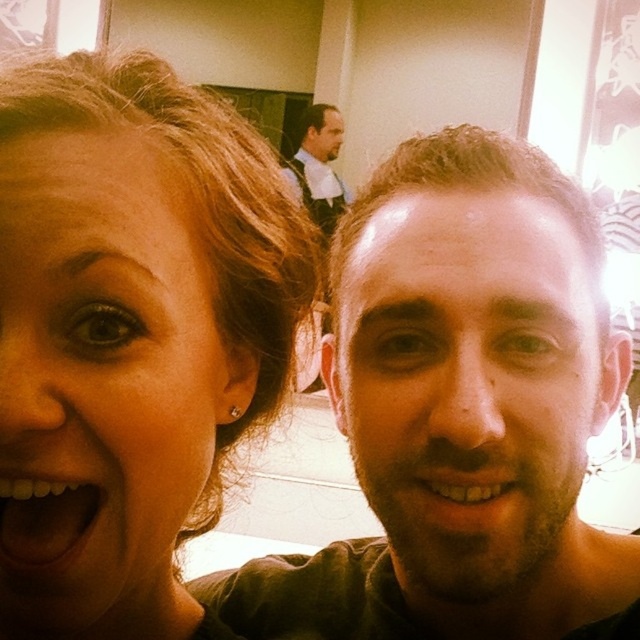
You are using a photo editing software and want to add a filter to the brown matte face at center. The software requires you to click exactly on its location. Based on the coordinates provided, where should you click?

You should click at point coordinates (467, 381) to apply the filter to the brown matte face at center.

Consider the image. You are taking a selfie with your friend and want to ensure the photo is clear. The camera you are using has a minimum focus distance of 12 inches. Based on the scene description, will the brown matte face at center be in focus?

The brown matte face at center and camera are 12.41 inches apart, which is slightly beyond the minimum focus distance of 12 inches. Therefore, the brown matte face at center should be in focus.